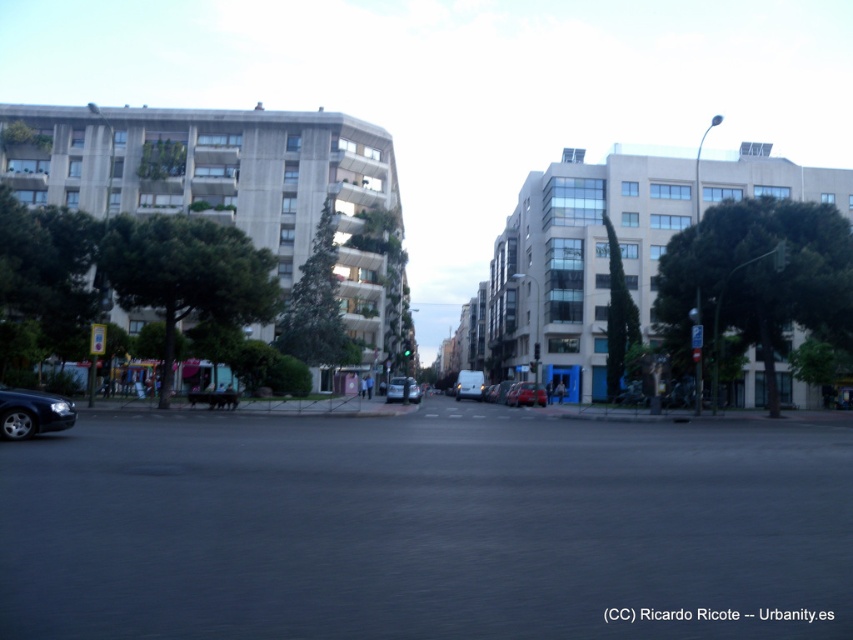
Looking at this image, you are a delivery driver who needs to park your truck in this area. You see the shiny black sedan at lower left and the silver metallic van at center. Which vehicle is shorter and would allow you to park closer to the curb without hitting the van?

The shiny black sedan at lower left is shorter than the silver metallic van at center, so you can park closer to the curb near the shiny black sedan at lower left without hitting the van.

You are a pedestrian standing on the sidewalk and want to cross the street to reach the buildings ahead. There is a shiny black sedan at lower left and a silver metallic van at center. Which vehicle is closer to you as you stand on the sidewalk?

The shiny black sedan at lower left is closer to you because it is located above the silver metallic van at center, indicating it is positioned nearer in the scene.

You are a delivery driver who needs to park your vehicle in this area. There is a shiny black sedan at lower left and a shiny red car at center. Which parking spot would allow you to fit your truck, which is 6 meters long?

The shiny red car at center occupies more space than the shiny black sedan at lower left. Since your truck is 6 meters long, the parking spot near the shiny red car at center would be more suitable as it likely has enough space.